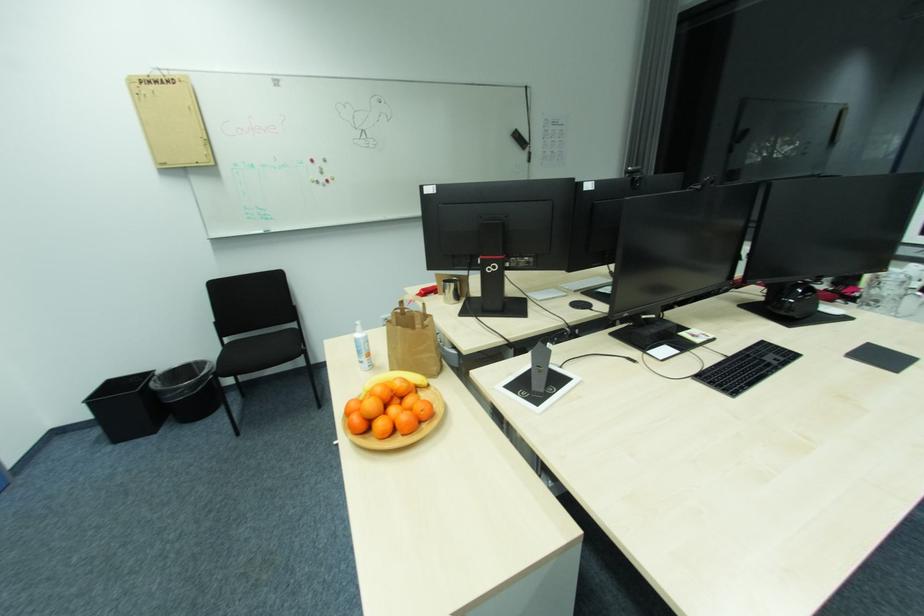
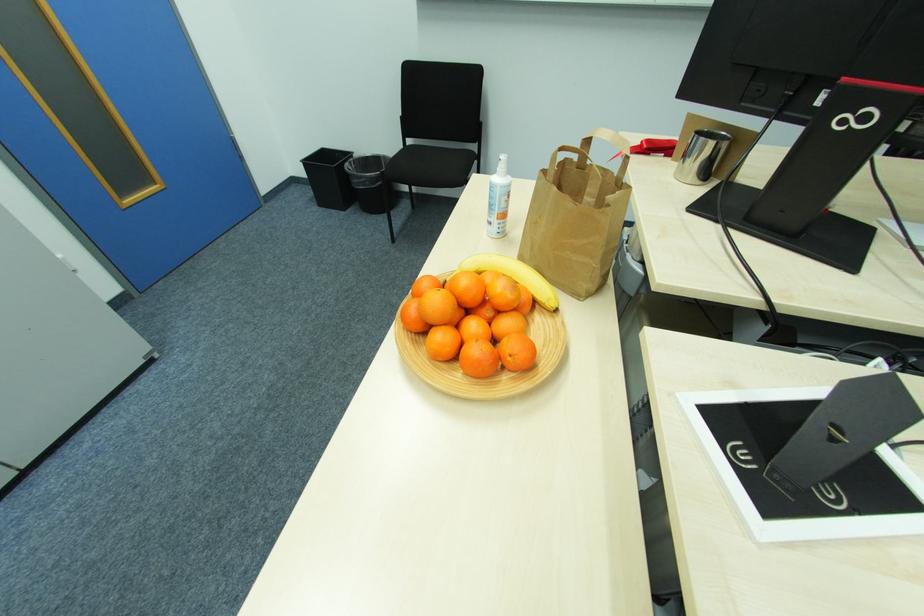
In the scene shown: The first image is from the beginning of the video and the second image is from the end. How did the camera likely rotate when shooting the video?

The camera's rotation is toward left-down.